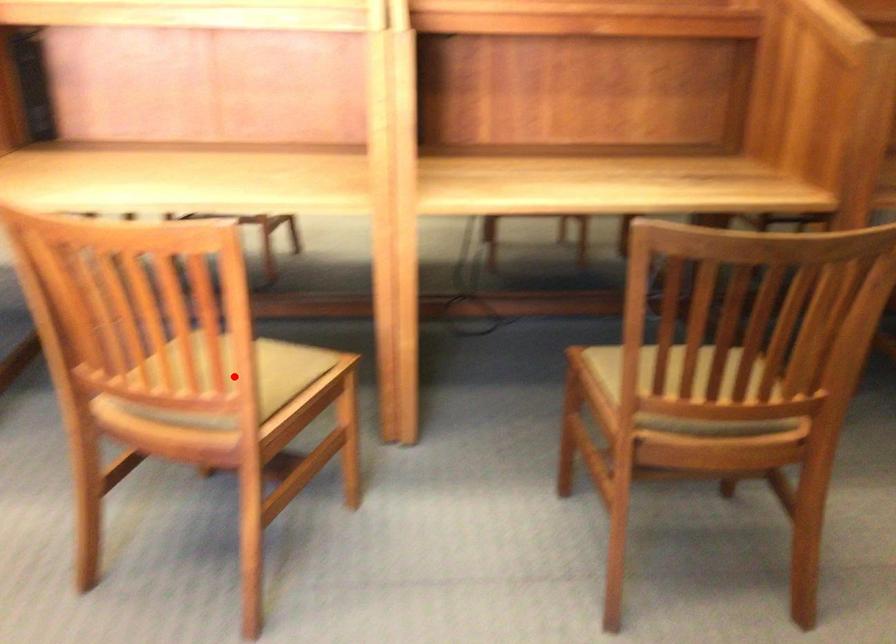
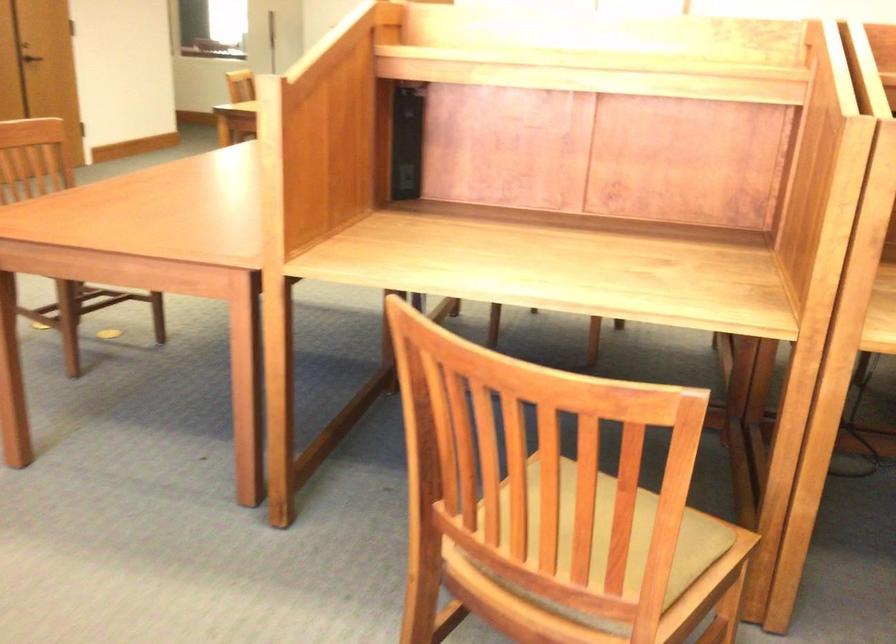
The point at the highlighted location is marked in the first image. Where is the corresponding point in the second image?

(651, 565)